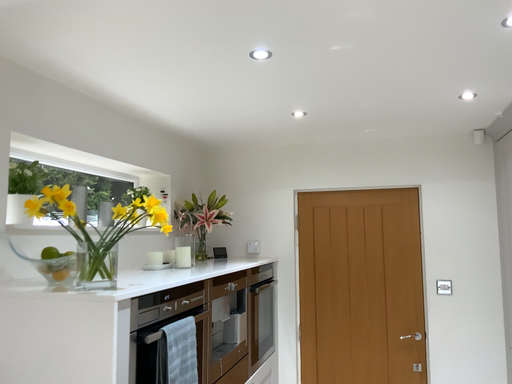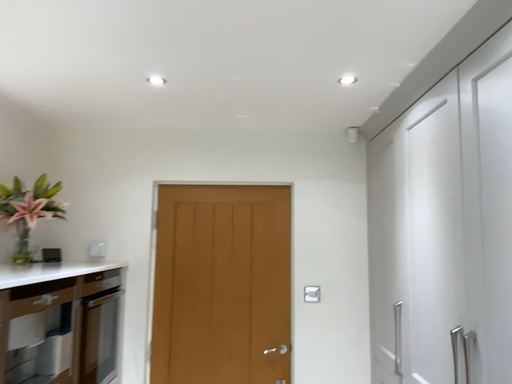
Question: How did the camera likely rotate when shooting the video?

Choices:
 (A) rotated right
 (B) rotated left

Answer: (A)